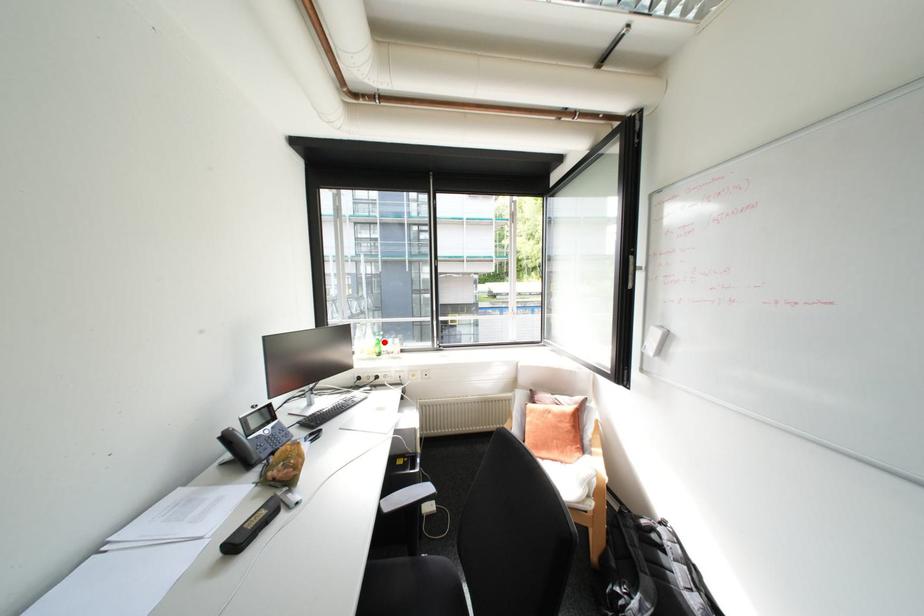
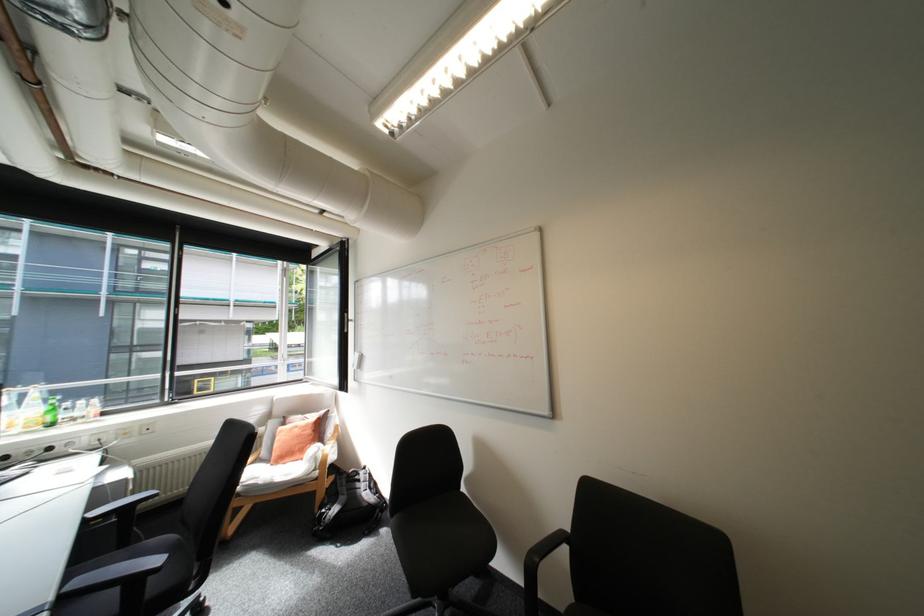
Locate, in the second image, the point that corresponds to the highlighted location in the first image.

(55, 408)